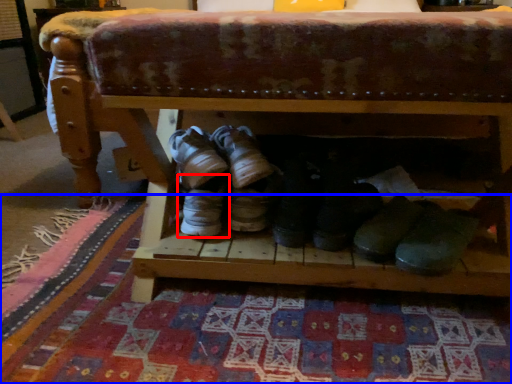
Question: Which object is further to the camera taking this photo, footwear (highlighted by a red box) or mat (highlighted by a blue box)?

Choices:
 (A) footwear
 (B) mat

Answer: (A)